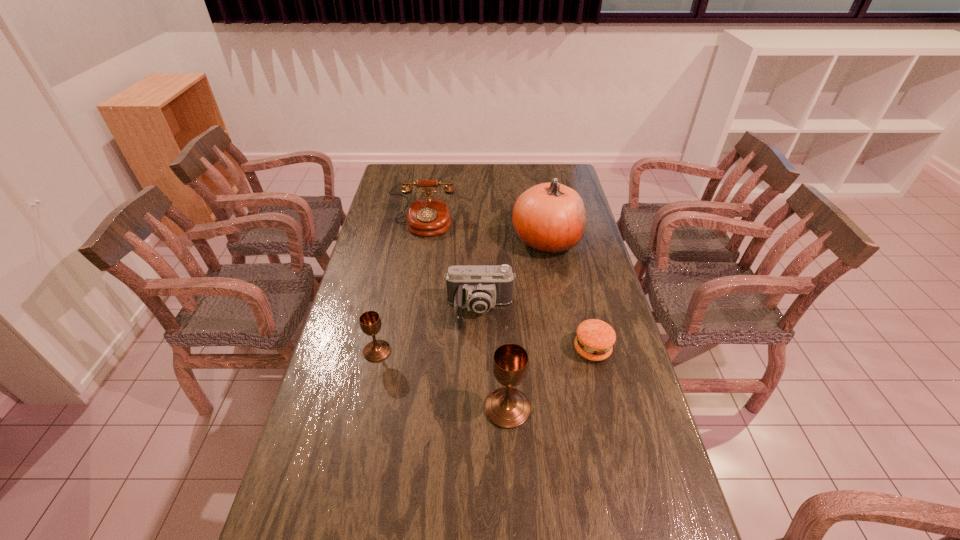
The height and width of the screenshot is (540, 960). Find the location of `free space at the right edge of the desktop`. free space at the right edge of the desktop is located at coordinates pos(613,443).

Locate an element on the screen. Image resolution: width=960 pixels, height=540 pixels. vacant area at the far left corner of the desktop is located at coordinates (418, 164).

This screenshot has width=960, height=540. I want to click on free location at the near left corner of the desktop, so [x=306, y=512].

In the image, there is a desktop. Identify the location of free space at the near right corner. The width and height of the screenshot is (960, 540). (669, 504).

At what (x,y) coordinates should I click in order to perform the action: click on blank region between the left chalice and the shortest object. Please return your answer as a coordinate pair (x, y). Looking at the image, I should click on (485, 350).

What are the coordinates of `vacant area that lies between the tallest object and the patty` in the screenshot? It's located at (569, 295).

Locate an element on the screen. The image size is (960, 540). free space between the fourth nearest object and the patty is located at coordinates (536, 331).

You are a GUI agent. You are given a task and a screenshot of the screen. Output one action in this format:
    pyautogui.click(x=<x>, y=<y>)
    Task: Click on the vacant area that lies between the telephone and the left chalice
    The width and height of the screenshot is (960, 540).
    Given the screenshot: What is the action you would take?
    pyautogui.click(x=400, y=287)

Image resolution: width=960 pixels, height=540 pixels. Find the location of `vacant area that lies between the telephone and the second tallest object`. vacant area that lies between the telephone and the second tallest object is located at coordinates (466, 316).

Locate an element on the screen. free space between the patty and the tallest object is located at coordinates pyautogui.click(x=569, y=295).